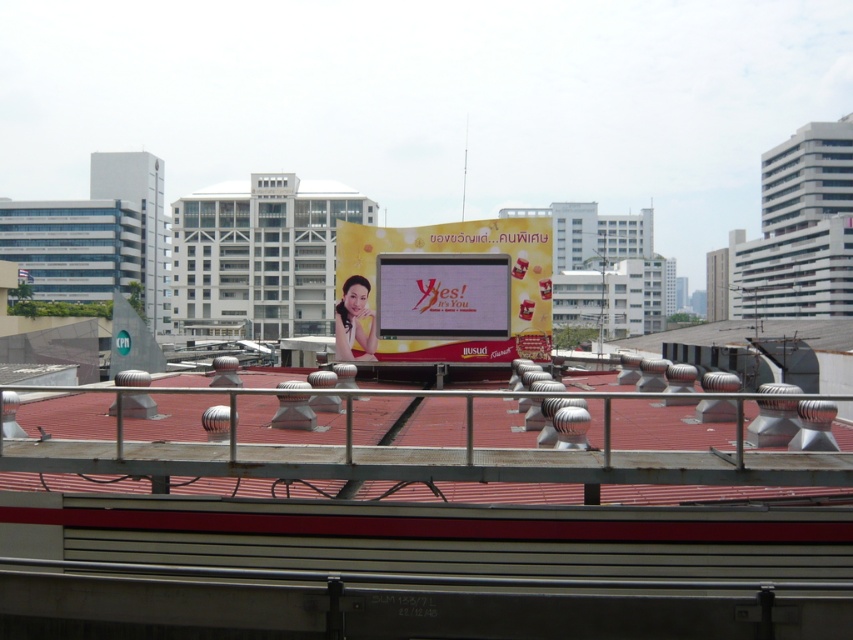
Question: Does metal at center have a larger size compared to yellow fabric billboard at center?

Choices:
 (A) no
 (B) yes

Answer: (A)

Question: Does metal at center have a larger size compared to yellow fabric billboard at center?

Choices:
 (A) no
 (B) yes

Answer: (A)

Question: Does metal at center have a lesser width compared to yellow fabric billboard at center?

Choices:
 (A) no
 (B) yes

Answer: (B)

Question: Which of the following is the closest to the observer?

Choices:
 (A) (492, 480)
 (B) (352, 280)

Answer: (A)